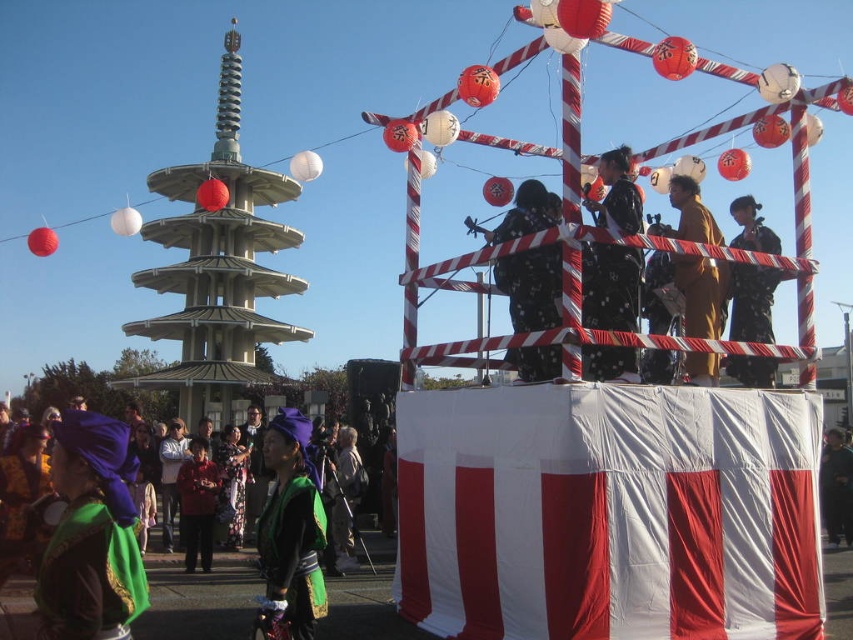
You are standing in the crowd watching the festival float. You notice two points marked on the float. Which point is closer to you, point (633,362) or point (744,356)?

Point (633,362) is closer to you than point (744,356).